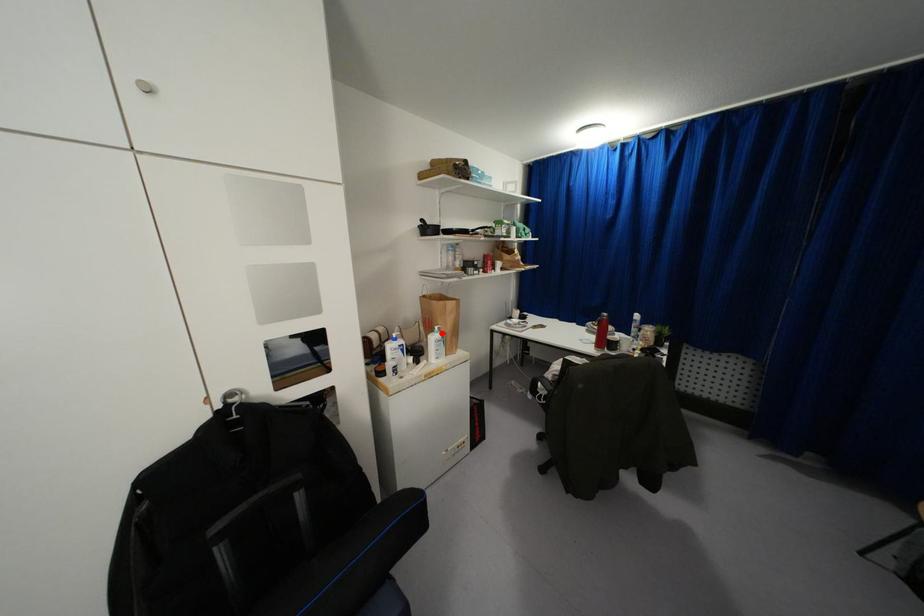
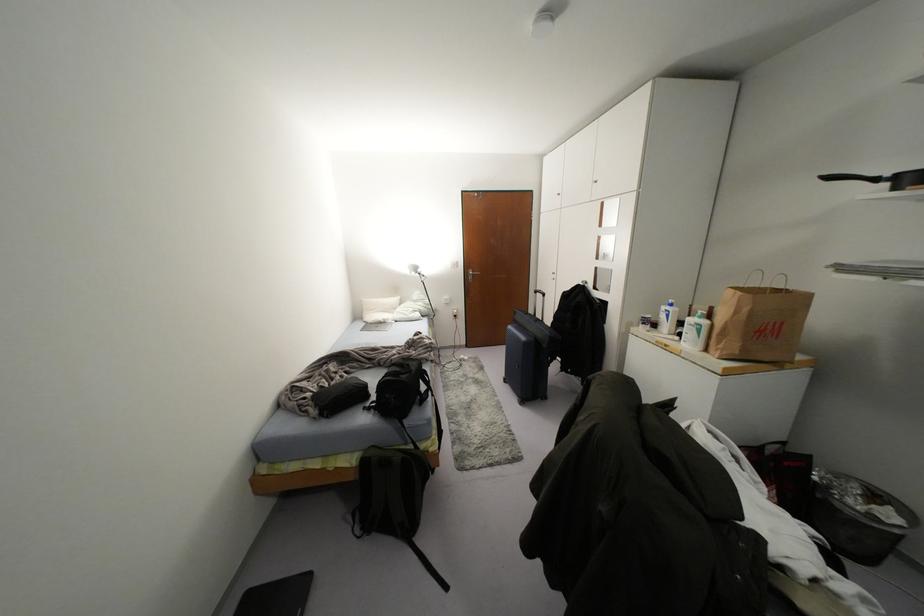
Question: I am providing you with two images of the same scene from different viewpoints. Image1 has a red point marked. In image2, the corresponding 3D location appears at what relative position? Reply with the corresponding letter.

Choices:
 (A) Closer
 (B) Farther

Answer: (A)